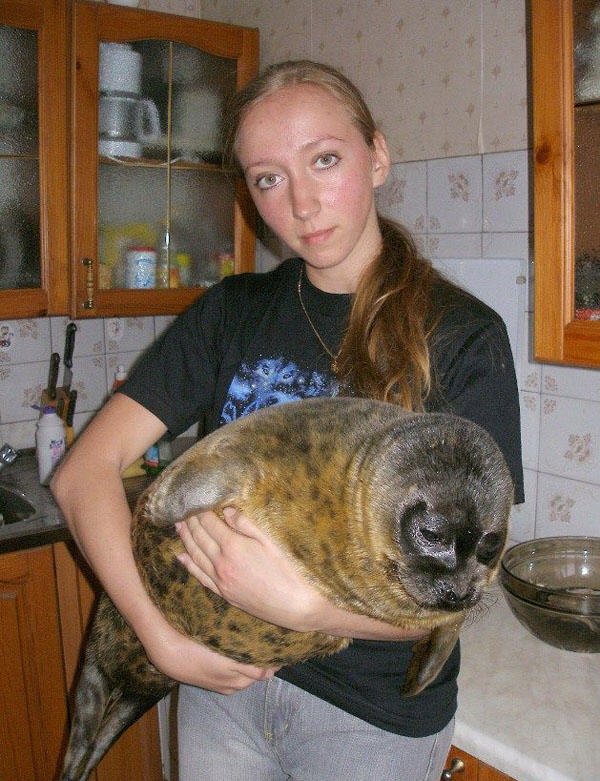
At what (x,y) coordinates should I click in order to perform the action: click on bowl. Please return your answer as a coordinate pair (x, y). The width and height of the screenshot is (600, 781). Looking at the image, I should click on (586, 607).